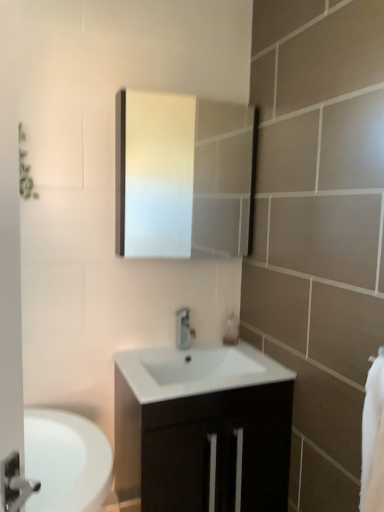
Question: Should I look upward or downward to see translucent plastic soap dispenser at center?

Choices:
 (A) up
 (B) down

Answer: (B)

Question: Is white glossy sink at center completely or partially inside white glossy medicine cabinet at upper center?

Choices:
 (A) yes
 (B) no

Answer: (B)

Question: Is white glossy medicine cabinet at upper center facing towards white glossy sink at center?

Choices:
 (A) yes
 (B) no

Answer: (B)

Question: Is white glossy medicine cabinet at upper center completely or partially outside of white glossy sink at center?

Choices:
 (A) no
 (B) yes

Answer: (B)

Question: Is white glossy sink at center at the back of white glossy medicine cabinet at upper center?

Choices:
 (A) yes
 (B) no

Answer: (B)

Question: Can you confirm if white glossy medicine cabinet at upper center is shorter than white glossy sink at center?

Choices:
 (A) yes
 (B) no

Answer: (B)

Question: From a real-world perspective, is white glossy medicine cabinet at upper center on top of white glossy sink at center?

Choices:
 (A) yes
 (B) no

Answer: (A)

Question: From a real-world perspective, does translucent plastic soap dispenser at center stand above silver metallic faucet at center?

Choices:
 (A) yes
 (B) no

Answer: (B)

Question: From the image's perspective, does translucent plastic soap dispenser at center appear higher than silver metallic faucet at center?

Choices:
 (A) no
 (B) yes

Answer: (A)

Question: Can you confirm if translucent plastic soap dispenser at center is wider than silver metallic faucet at center?

Choices:
 (A) yes
 (B) no

Answer: (B)

Question: Is translucent plastic soap dispenser at center far away from silver metallic faucet at center?

Choices:
 (A) yes
 (B) no

Answer: (B)

Question: Does translucent plastic soap dispenser at center have a lesser width compared to silver metallic faucet at center?

Choices:
 (A) yes
 (B) no

Answer: (A)

Question: Considering the relative sizes of translucent plastic soap dispenser at center and silver metallic faucet at center in the image provided, is translucent plastic soap dispenser at center bigger than silver metallic faucet at center?

Choices:
 (A) yes
 (B) no

Answer: (B)

Question: Does silver metallic faucet at center have a greater height compared to white glossy sink at center?

Choices:
 (A) no
 (B) yes

Answer: (B)